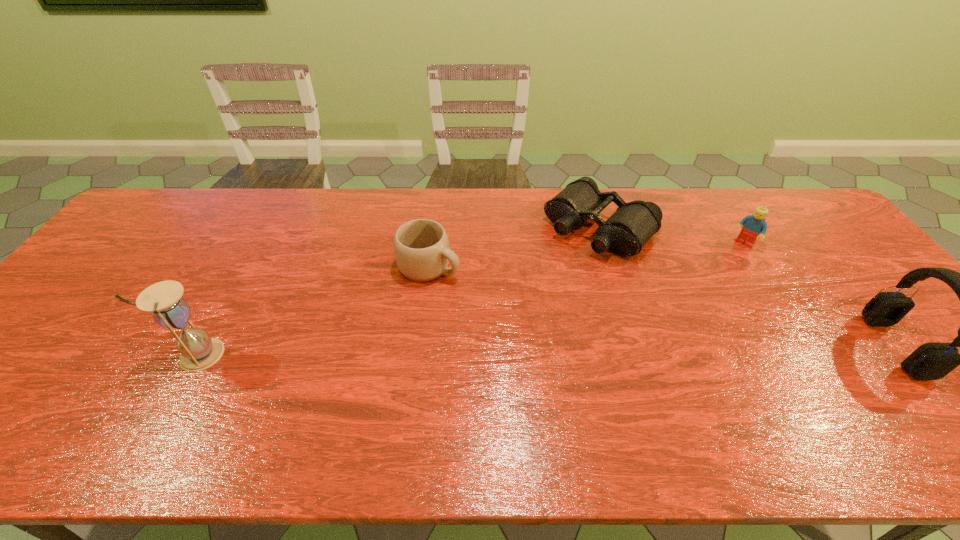
Find the location of a particular element. This screenshot has height=540, width=960. the leftmost object is located at coordinates (199, 351).

The image size is (960, 540). Identify the location of headset. (931, 361).

In order to click on the third object from right to left in this screenshot , I will do `click(625, 232)`.

I want to click on the second object from left to right, so click(421, 247).

Where is `Lego`? Lego is located at coordinates (753, 225).

At what (x,y) coordinates should I click in order to perform the action: click on vacant space positioned on the right of the hourglass. Please return your answer as a coordinate pair (x, y). The width and height of the screenshot is (960, 540). Looking at the image, I should click on (310, 354).

You are a GUI agent. You are given a task and a screenshot of the screen. Output one action in this format:
    pyautogui.click(x=<x>, y=<y>)
    Task: Click on the free point located 0.200m on the headband of the rightmost object
    
    Given the screenshot: What is the action you would take?
    pyautogui.click(x=793, y=346)

Find the location of a particular element. The image size is (960, 540). free spot located 0.270m on the headband of the rightmost object is located at coordinates (764, 346).

The width and height of the screenshot is (960, 540). Find the location of `free space located 0.160m on the headband of the rightmost object`. free space located 0.160m on the headband of the rightmost object is located at coordinates (810, 346).

The width and height of the screenshot is (960, 540). Find the location of `free space located through the eyepieces of the binoculars`. free space located through the eyepieces of the binoculars is located at coordinates (499, 323).